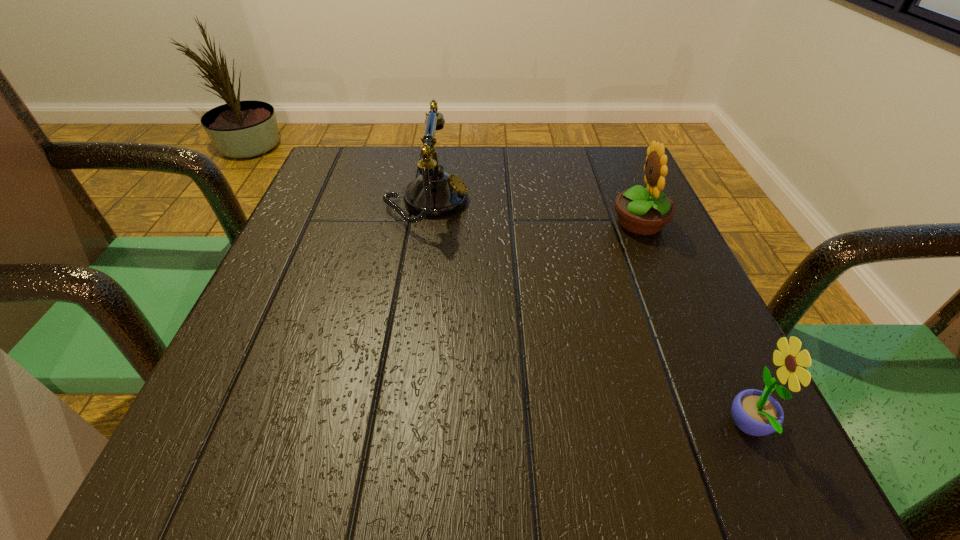
Find the location of a particular element. vacant area that lies between the nearest object and the farther sunflower is located at coordinates (694, 325).

Locate an element on the screen. The width and height of the screenshot is (960, 540). vacant area that lies between the nearer sunflower and the leftmost object is located at coordinates (588, 315).

Where is `free space between the farther sunflower and the leftmost object`? The image size is (960, 540). free space between the farther sunflower and the leftmost object is located at coordinates (533, 212).

Locate an element on the screen. The height and width of the screenshot is (540, 960). free space between the nearest object and the leftmost object is located at coordinates (588, 315).

At what (x,y) coordinates should I click in order to perform the action: click on vacant region between the leftmost object and the farther sunflower. Please return your answer as a coordinate pair (x, y). The image size is (960, 540). Looking at the image, I should click on (533, 212).

The width and height of the screenshot is (960, 540). I want to click on unoccupied position between the leftmost object and the farther sunflower, so click(533, 212).

Identify the location of vacant space that is in between the nearer sunflower and the telephone. The height and width of the screenshot is (540, 960). (588, 315).

Where is `vacant point located between the farther sunflower and the nearest object`? The image size is (960, 540). vacant point located between the farther sunflower and the nearest object is located at coordinates (694, 325).

In order to click on vacant space that's between the farther sunflower and the nearer sunflower in this screenshot , I will do `click(694, 325)`.

Locate an element on the screen. Image resolution: width=960 pixels, height=540 pixels. empty location between the telephone and the farther sunflower is located at coordinates (533, 212).